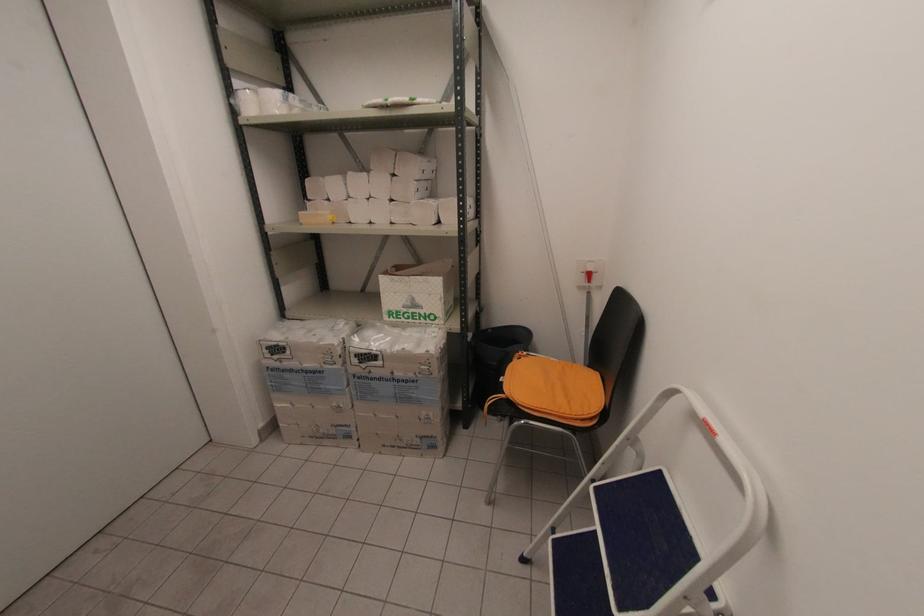
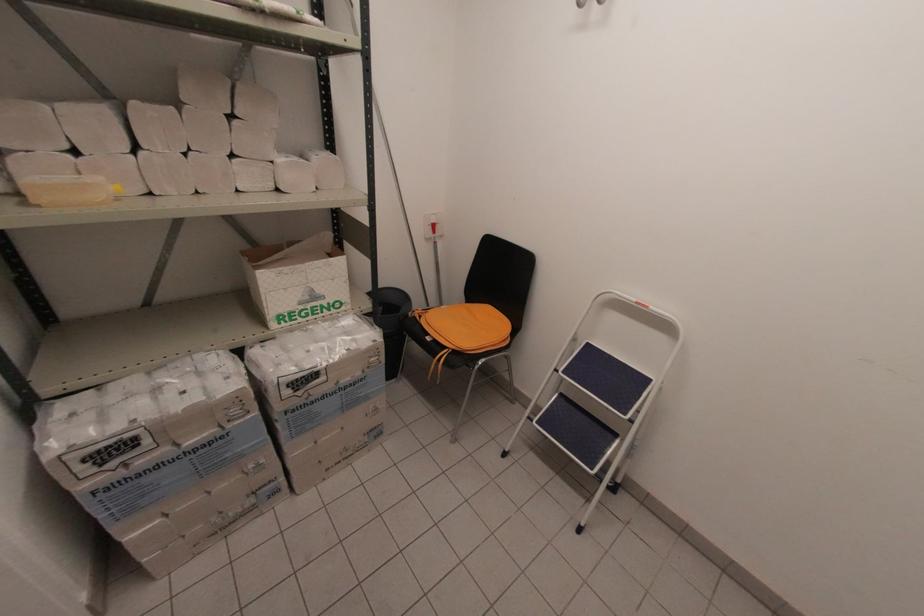
Locate, in the second image, the point that corresponds to [268,350] in the first image.

(84, 463)